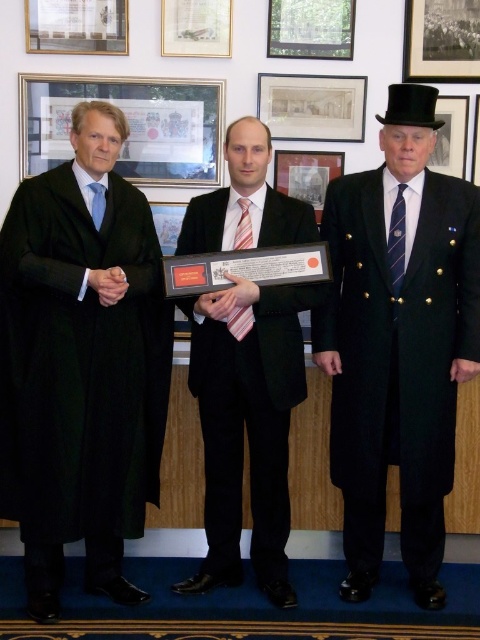
Question: Which of the following is the closest to the observer?

Choices:
 (A) matte glass picture frame at upper left
 (B) matte paper picture frame at upper center
 (C) black wool coat at right
 (D) wooden framed photo at center

Answer: (C)

Question: Can you confirm if black wool coat at right is positioned below matte glass picture frame at upper left?

Choices:
 (A) yes
 (B) no

Answer: (A)

Question: Among these points, which one is nearest to the camera?

Choices:
 (A) (187, 88)
 (B) (305, 168)

Answer: (A)

Question: In this image, where is black woolen robe at left located relative to matte glass picture frame at upper left?

Choices:
 (A) above
 (B) below

Answer: (B)

Question: Is matte glass picture frame at upper left bigger than matte paper picture frame at upper center?

Choices:
 (A) no
 (B) yes

Answer: (B)

Question: Which of the following is the closest to the observer?

Choices:
 (A) (291, 164)
 (B) (296, 100)

Answer: (B)